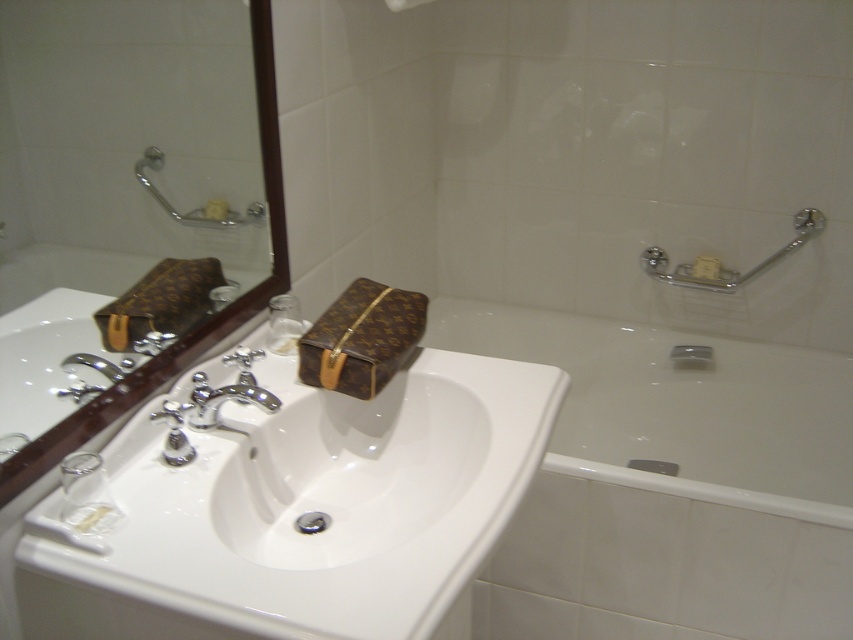
Consider the image. You are organizing the bathroom and need to place a new decorative item between the yellow matte soap at upper center and the matte brown towel bar at upper center. Is there enough space to fit a small 5cm wide vase between them?

The yellow matte soap at upper center is to the left of the matte brown towel bar at upper center. Since the distance between them isn not specified, but the vase is only 5cm wide, it might fit if the space between them is at least 5cm. However, without exact measurements, we can only assume there is sufficient space based on typical bathroom layouts.

You are organizing your bathroom and want to place both the brown leather mirror at upper left and the brown leather toiletry bag at center on a shelf. Which item will take up more space on the shelf?

The brown leather mirror at upper left is larger than the brown leather toiletry bag at center, so it will take up more space on the shelf.

You are a guest in this bathroom and need to place the yellow matte soap at upper center into the white glossy bathtub at lower right. Can you fit the soap into the bathtub?

The white glossy bathtub at lower right is larger in size than yellow matte soap at upper center, so yes, the soap can fit into the bathtub since it is smaller than the bathtub.